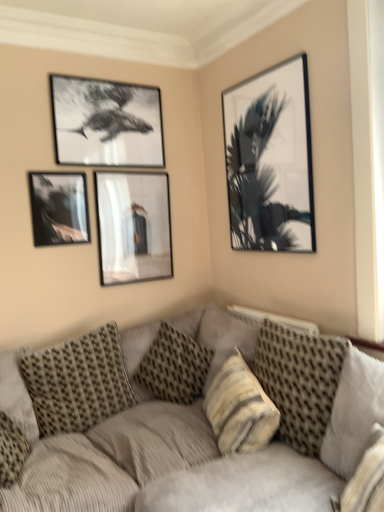
Question: Is textured beige pillow at lower left, arranged as the first pillow when viewed from the left, outside textured beige pillow at center, which is counted as the 4th pillow, starting from the right?

Choices:
 (A) no
 (B) yes

Answer: (A)

Question: Is textured beige pillow at lower left, arranged as the first pillow when viewed from the left, surrounding textured beige pillow at center, which is counted as the 4th pillow, starting from the right?

Choices:
 (A) yes
 (B) no

Answer: (B)

Question: Is textured beige pillow at lower left, arranged as the first pillow when viewed from the left, positioned with its back to textured beige pillow at center, which is counted as the 4th pillow, starting from the right?

Choices:
 (A) no
 (B) yes

Answer: (A)

Question: Would you say textured beige pillow at lower left, which is the fifth pillow from right to left, is a long distance from textured beige pillow at center, which is counted as the second pillow, starting from the left?

Choices:
 (A) yes
 (B) no

Answer: (B)

Question: Does textured beige pillow at lower left, arranged as the first pillow when viewed from the left, turn towards textured beige pillow at center, which is counted as the 4th pillow, starting from the right?

Choices:
 (A) no
 (B) yes

Answer: (A)

Question: Does textured beige pillow at lower left, which is the fifth pillow from right to left, have a larger size compared to textured beige pillow at center, which is counted as the 4th pillow, starting from the right?

Choices:
 (A) no
 (B) yes

Answer: (A)

Question: Is black glossy helicopter at upper left, the 3th picture frame from the right, thinner than patterned fabric pillow at center, positioned as the third pillow in right-to-left order?

Choices:
 (A) no
 (B) yes

Answer: (B)

Question: Does black glossy helicopter at upper left, the 2th picture frame when ordered from left to right, appear on the right side of patterned fabric pillow at center, which ranks as the third pillow in left-to-right order?

Choices:
 (A) yes
 (B) no

Answer: (B)

Question: Would you say patterned fabric pillow at center, which ranks as the third pillow in left-to-right order, is part of black glossy helicopter at upper left, the 2th picture frame when ordered from left to right,'s contents?

Choices:
 (A) no
 (B) yes

Answer: (A)

Question: From the image's perspective, is black glossy helicopter at upper left, the 3th picture frame from the right, below patterned fabric pillow at center, which ranks as the third pillow in left-to-right order?

Choices:
 (A) yes
 (B) no

Answer: (B)

Question: From a real-world perspective, is black glossy helicopter at upper left, the 2th picture frame when ordered from left to right, under patterned fabric pillow at center, which ranks as the third pillow in left-to-right order?

Choices:
 (A) yes
 (B) no

Answer: (B)

Question: Is black glossy helicopter at upper left, the 2th picture frame when ordered from left to right, aimed at patterned fabric pillow at center, positioned as the third pillow in right-to-left order?

Choices:
 (A) no
 (B) yes

Answer: (A)

Question: Does textured beige pillow at lower left, arranged as the first pillow when viewed from the left, have a greater width compared to patterned fabric pillow at center, which ranks as the third pillow in left-to-right order?

Choices:
 (A) yes
 (B) no

Answer: (B)